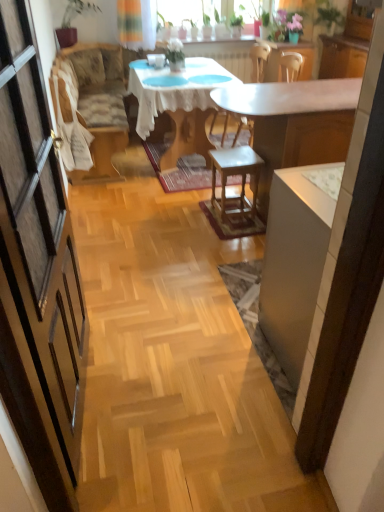
Find the location of a particular element. The width and height of the screenshot is (384, 512). vacant space situated above white lace tablecloth at center (from a real-world perspective) is located at coordinates (187, 69).